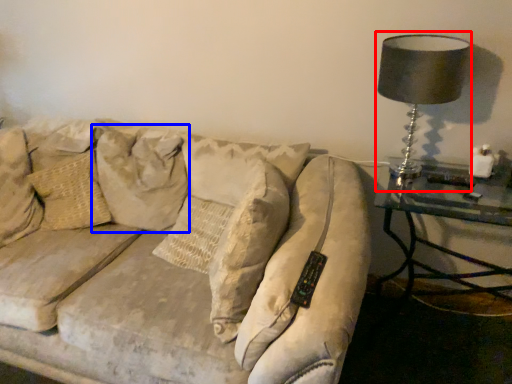
Question: Which object is closer to the camera taking this photo, table lamp (highlighted by a red box) or pillow (highlighted by a blue box)?

Choices:
 (A) table lamp
 (B) pillow

Answer: (A)